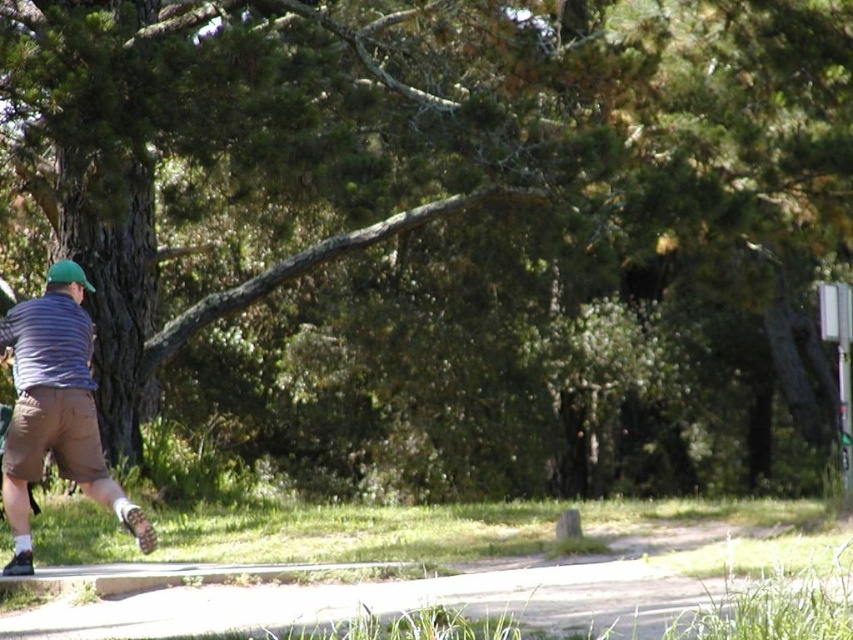
Question: Can you confirm if green grass at lower center is bigger than striped cotton shirt at left?

Choices:
 (A) no
 (B) yes

Answer: (A)

Question: Which point appears closest to the camera in this image?

Choices:
 (A) (651, 609)
 (B) (27, 508)

Answer: (A)

Question: Does green grass at lower center have a smaller size compared to striped cotton shirt at left?

Choices:
 (A) no
 (B) yes

Answer: (B)

Question: Is green grass at lower center further to the viewer compared to striped cotton shirt at left?

Choices:
 (A) no
 (B) yes

Answer: (A)

Question: Which point is farther from the camera taking this photo?

Choices:
 (A) (659, 580)
 (B) (91, 342)

Answer: (A)

Question: Which object appears closest to the camera in this image?

Choices:
 (A) green grass at lower center
 (B) striped cotton shirt at left

Answer: (A)